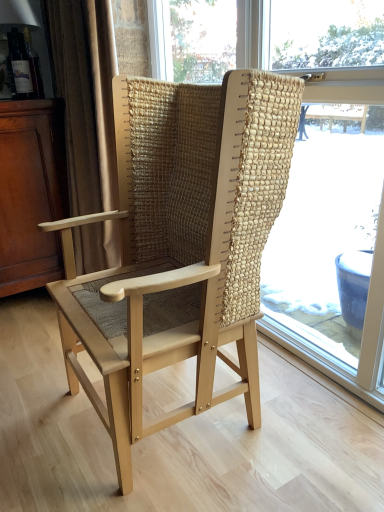
Question: Is the position of mahogany wood dresser at left less distant than that of natural woven fabric chair at center?

Choices:
 (A) yes
 (B) no

Answer: (B)

Question: Is mahogany wood dresser at left taller than natural woven fabric chair at center?

Choices:
 (A) no
 (B) yes

Answer: (A)

Question: From the image's perspective, is mahogany wood dresser at left below natural woven fabric chair at center?

Choices:
 (A) yes
 (B) no

Answer: (A)

Question: Is mahogany wood dresser at left bigger than natural woven fabric chair at center?

Choices:
 (A) yes
 (B) no

Answer: (A)

Question: From a real-world perspective, is mahogany wood dresser at left beneath natural woven fabric chair at center?

Choices:
 (A) yes
 (B) no

Answer: (A)

Question: From a real-world perspective, is natural woven fabric chair at center positioned above or below beige fabric curtain at left?

Choices:
 (A) below
 (B) above

Answer: (A)

Question: In terms of height, does natural woven fabric chair at center look taller or shorter compared to beige fabric curtain at left?

Choices:
 (A) tall
 (B) short

Answer: (A)

Question: Looking at the image, does natural woven fabric chair at center seem bigger or smaller compared to beige fabric curtain at left?

Choices:
 (A) big
 (B) small

Answer: (A)

Question: Looking at their shapes, would you say natural woven fabric chair at center is wider or thinner than beige fabric curtain at left?

Choices:
 (A) wide
 (B) thin

Answer: (B)

Question: Would you say mahogany wood dresser at left is to the left or to the right of beige fabric curtain at left in the picture?

Choices:
 (A) right
 (B) left

Answer: (B)

Question: In terms of width, does mahogany wood dresser at left look wider or thinner when compared to beige fabric curtain at left?

Choices:
 (A) thin
 (B) wide

Answer: (B)

Question: Relative to beige fabric curtain at left, is mahogany wood dresser at left in front or behind?

Choices:
 (A) front
 (B) behind

Answer: (B)

Question: Is mahogany wood dresser at left taller or shorter than beige fabric curtain at left?

Choices:
 (A) short
 (B) tall

Answer: (A)

Question: From the image's perspective, is natural woven fabric chair at center positioned above or below natural wood chair at center?

Choices:
 (A) above
 (B) below

Answer: (A)

Question: Considering their positions, is natural woven fabric chair at center located in front of or behind natural wood chair at center?

Choices:
 (A) front
 (B) behind

Answer: (B)